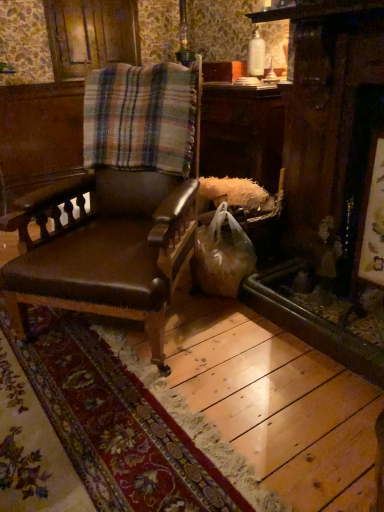
In order to click on translucent plastic bag at lower right in this screenshot , I will do `click(223, 254)`.

You are a GUI agent. You are given a task and a screenshot of the screen. Output one action in this format:
    pyautogui.click(x=<x>, y=<y>)
    Task: Click on the plaid fabric at center
    The width and height of the screenshot is (384, 512).
    Given the screenshot: What is the action you would take?
    pyautogui.click(x=141, y=117)

Where is `translucent plastic bag at lower right`? The width and height of the screenshot is (384, 512). translucent plastic bag at lower right is located at coordinates (223, 254).

Considering their positions, is plaid fabric at center located in front of or behind matte brown leather chair at center?

plaid fabric at center is behind matte brown leather chair at center.

Does point (129, 108) appear closer or farther from the camera than point (127, 87)?

Point (129, 108) is closer to the camera than point (127, 87).

Is plaid fabric at center oriented away from matte brown leather chair at center?

Absolutely, plaid fabric at center is directed away from matte brown leather chair at center.

How many degrees apart are the facing directions of plaid fabric at center and matte brown leather chair at center?

The angle between the facing direction of plaid fabric at center and the facing direction of matte brown leather chair at center is 4.27 degrees.

From the picture: Would you say plaid fabric at center is inside or outside translucent plastic bag at lower right?

plaid fabric at center is located beyond the bounds of translucent plastic bag at lower right.

What's the angular difference between plaid fabric at center and translucent plastic bag at lower right's facing directions?

There is a 39.2-degree angle between the facing directions of plaid fabric at center and translucent plastic bag at lower right.

From the image's perspective, is plaid fabric at center above or below translucent plastic bag at lower right?

plaid fabric at center is situated higher than translucent plastic bag at lower right in the image.

In the scene shown: Considering the relative sizes of plaid fabric at center and translucent plastic bag at lower right in the image provided, is plaid fabric at center bigger than translucent plastic bag at lower right?

Yes, plaid fabric at center is bigger than translucent plastic bag at lower right.

Looking at this image, from the image's perspective, is translucent plastic bag at lower right on plaid fabric at center?

No, from the image's perspective, translucent plastic bag at lower right is not on top of plaid fabric at center.

From a real-world perspective, is translucent plastic bag at lower right over plaid fabric at center?

Incorrect, from a real-world perspective, translucent plastic bag at lower right is lower than plaid fabric at center.

Identify the location of blanket lying above the translucent plastic bag at lower right (from the image's perspective). (141, 117).

Which object is wider, translucent plastic bag at lower right or plaid fabric at center?

Wider between the two is translucent plastic bag at lower right.

Is plaid fabric at center completely or partially inside matte brown leather chair at center?

Absolutely, plaid fabric at center is inside matte brown leather chair at center.

Can you confirm if matte brown leather chair at center is wider than plaid fabric at center?

Yes.

Which of these two, matte brown leather chair at center or plaid fabric at center, is smaller?

plaid fabric at center is smaller.

Could you tell me if translucent plastic bag at lower right is facing matte brown leather chair at center?

Yes.

Which is behind, point (207, 277) or point (187, 151)?

Positioned behind is point (207, 277).

Which object is wider, translucent plastic bag at lower right or matte brown leather chair at center?

Wider between the two is matte brown leather chair at center.

Is matte brown leather chair at center inside translucent plastic bag at lower right?

Actually, matte brown leather chair at center is outside translucent plastic bag at lower right.

Could you tell me if matte brown leather chair at center is facing translucent plastic bag at lower right?

No, matte brown leather chair at center is not facing towards translucent plastic bag at lower right.

This screenshot has width=384, height=512. In order to click on chair above the translucent plastic bag at lower right (from a real-world perspective) in this screenshot , I will do `click(121, 205)`.

From a real-world perspective, between matte brown leather chair at center and translucent plastic bag at lower right, who is vertically lower?

From a 3D spatial view, translucent plastic bag at lower right is below.

Considering the relative sizes of matte brown leather chair at center and translucent plastic bag at lower right in the image provided, is matte brown leather chair at center thinner than translucent plastic bag at lower right?

No.

You are a GUI agent. You are given a task and a screenshot of the screen. Output one action in this format:
    pyautogui.click(x=<x>, y=<y>)
    Task: Click on the chair located underneath the plaid fabric at center (from a real-world perspective)
    Image resolution: width=384 pixels, height=512 pixels.
    Given the screenshot: What is the action you would take?
    pyautogui.click(x=121, y=205)

In the image, there is a plaid fabric at center. What are the coordinates of `shopping bag below it (from the image's perspective)` in the screenshot? It's located at (223, 254).

Consider the image. From the image, which object appears to be farther from plaid fabric at center, matte brown leather chair at center or translucent plastic bag at lower right?

A: translucent plastic bag at lower right is positioned further to the anchor plaid fabric at center.

Based on their spatial positions, is translucent plastic bag at lower right or matte brown leather chair at center further from plaid fabric at center?

translucent plastic bag at lower right is further to plaid fabric at center.

From the image, which object appears to be farther from translucent plastic bag at lower right, plaid fabric at center or matte brown leather chair at center?

The object further to translucent plastic bag at lower right is plaid fabric at center.

Which object lies further to the anchor point matte brown leather chair at center, translucent plastic bag at lower right or plaid fabric at center?

translucent plastic bag at lower right lies further to matte brown leather chair at center than the other object.

Looking at the image, which one is located closer to matte brown leather chair at center, plaid fabric at center or translucent plastic bag at lower right?

The object closer to matte brown leather chair at center is plaid fabric at center.

Considering their positions, is matte brown leather chair at center positioned further to translucent plastic bag at lower right than plaid fabric at center?

Based on the image, plaid fabric at center appears to be further to translucent plastic bag at lower right.

You are a GUI agent. You are given a task and a screenshot of the screen. Output one action in this format:
    pyautogui.click(x=<x>, y=<y>)
    Task: Click on the blanket between matte brown leather chair at center and translucent plastic bag at lower right in the front-back direction
    
    Given the screenshot: What is the action you would take?
    pyautogui.click(x=141, y=117)